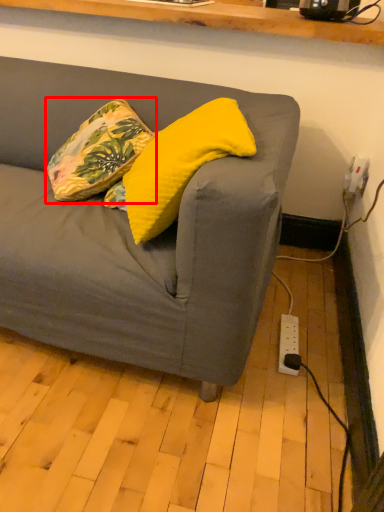
Question: Considering the relative positions of pillow (annotated by the red box) and pillow in the image provided, where is pillow (annotated by the red box) located with respect to the staircase?

Choices:
 (A) right
 (B) left

Answer: (B)